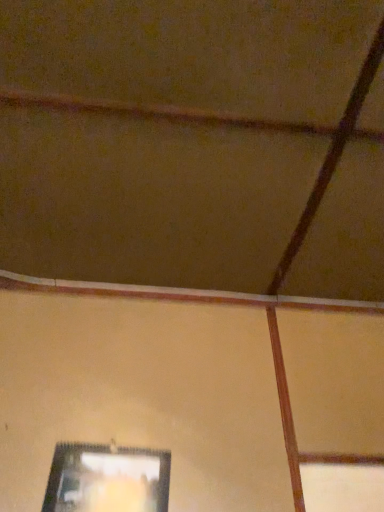
Locate an element on the screen. This screenshot has width=384, height=512. matte black picture frame at lower left is located at coordinates (107, 479).

What do you see at coordinates (107, 479) in the screenshot? I see `matte black picture frame at lower left` at bounding box center [107, 479].

Image resolution: width=384 pixels, height=512 pixels. In order to click on matte black picture frame at lower left in this screenshot , I will do `click(107, 479)`.